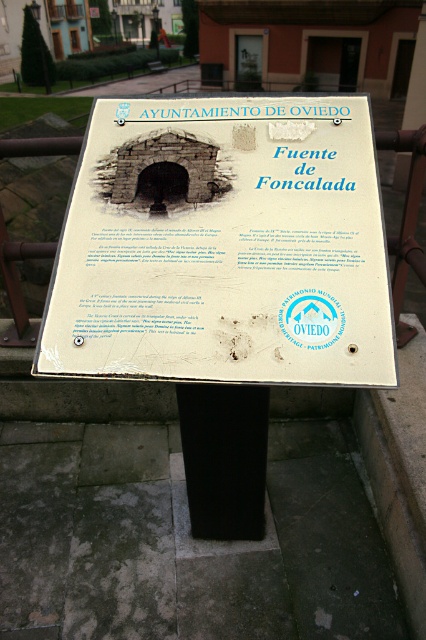
Does white plastic sign at center appear over black matte pole at center?

Correct, white plastic sign at center is located above black matte pole at center.

How distant is white plastic sign at center from black matte pole at center?

white plastic sign at center and black matte pole at center are 22.38 inches apart from each other.

The image size is (426, 640). What are the coordinates of `white plastic sign at center` in the screenshot? It's located at (224, 244).

This screenshot has height=640, width=426. Identify the location of white plastic sign at center. (224, 244).